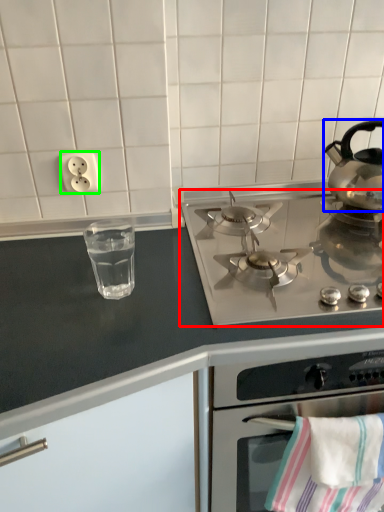
Question: Based on their relative distances, which object is nearer to gas stove (highlighted by a red box)? Choose from kettle (highlighted by a blue box) and electric outlet (highlighted by a green box).

Choices:
 (A) kettle
 (B) electric outlet

Answer: (A)